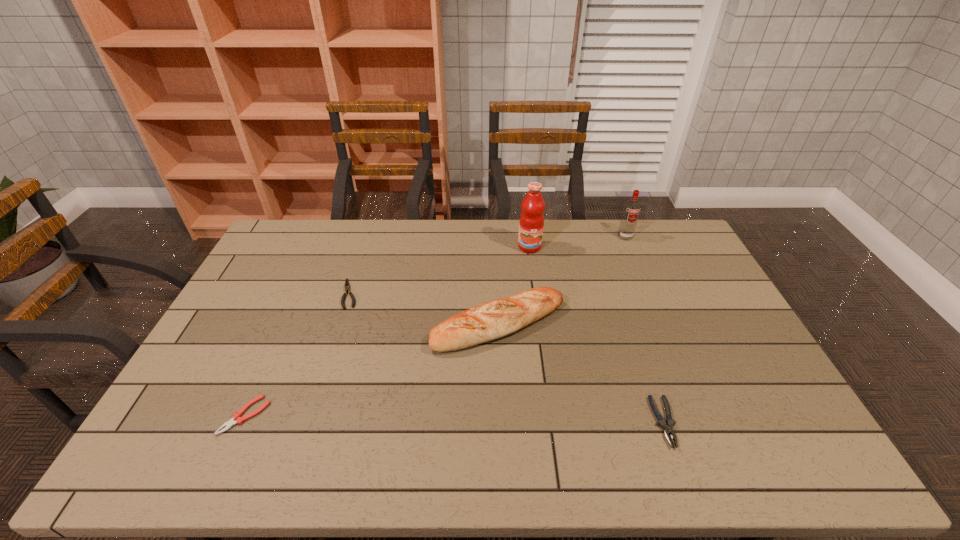
Identify the location of blank region between the leftmost pliers and the fourth shortest object. (372, 370).

Where is `free space between the vodka and the second object from right to left`? The image size is (960, 540). free space between the vodka and the second object from right to left is located at coordinates (644, 329).

The height and width of the screenshot is (540, 960). In order to click on unoccupied position between the fourth shortest object and the second pliers from left to right in this screenshot , I will do `click(424, 309)`.

You are a GUI agent. You are given a task and a screenshot of the screen. Output one action in this format:
    pyautogui.click(x=<x>, y=<y>)
    Task: Click on the free space between the second tallest object and the leftmost pliers
    This screenshot has width=960, height=540.
    Given the screenshot: What is the action you would take?
    pos(435,326)

Select which object appears as the closest to the rightmost object. Please provide its 2D coordinates. Your answer should be formatted as a tuple, i.e. [(x, y)], where the tuple contains the x and y coordinates of a point satisfying the conditions above.

[(531, 223)]

At what (x,y) coordinates should I click in order to perform the action: click on the fourth closest object to the fifth object from left to right. Please return your answer as a coordinate pair (x, y). This screenshot has height=540, width=960. Looking at the image, I should click on (347, 286).

Where is `pliers that stands as the second closest to the leftmost pliers`? The width and height of the screenshot is (960, 540). pliers that stands as the second closest to the leftmost pliers is located at coordinates (668, 429).

Locate which pliers ranks in proximity to the leftmost object. Please provide its 2D coordinates. Your answer should be formatted as a tuple, i.e. [(x, y)], where the tuple contains the x and y coordinates of a point satisfying the conditions above.

[(347, 286)]